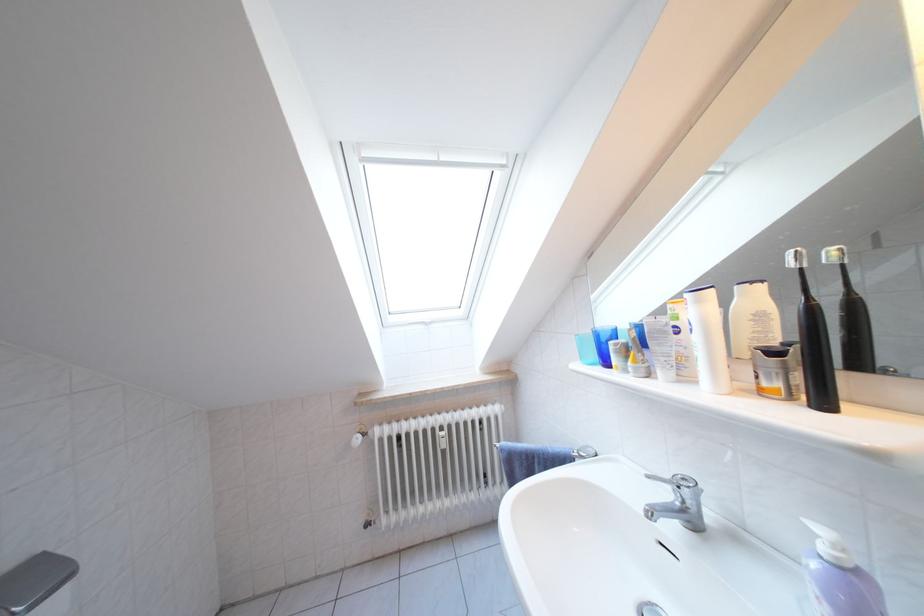
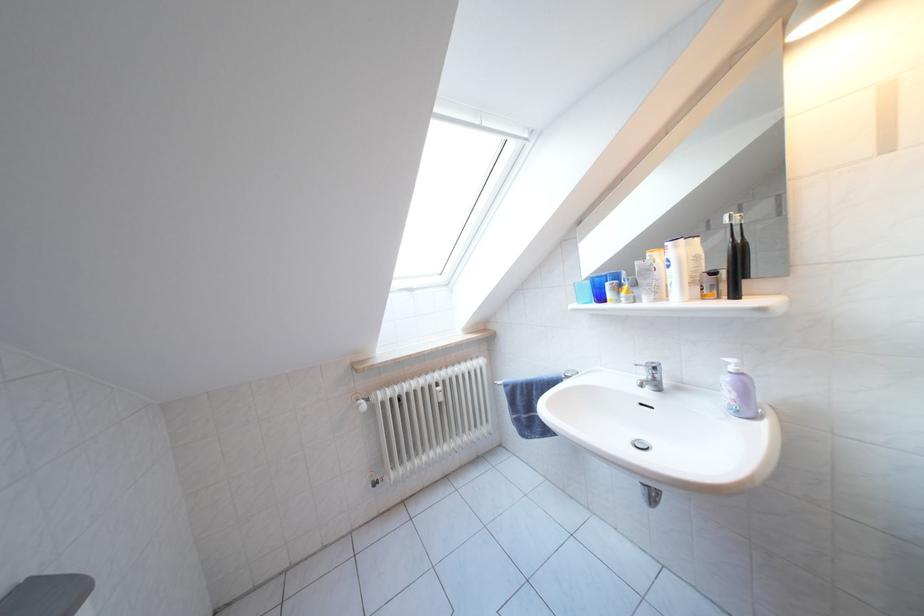
Question: The camera is either moving clockwise (left) or counter-clockwise (right) around the object. The first image is from the beginning of the video and the second image is from the end. Is the camera moving left or right when shooting the video?

Choices:
 (A) Left
 (B) Right

Answer: (A)